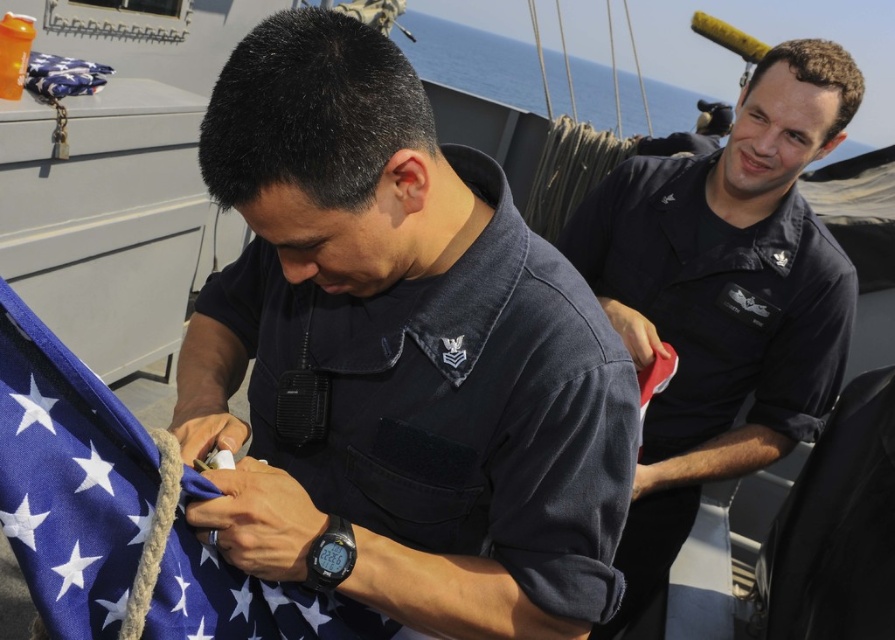
Can you confirm if dark blue uniform at center is taller than blue fabric flag at center?

Yes.

Which is more to the left, dark blue uniform at center or blue fabric flag at center?

From the viewer's perspective, blue fabric flag at center appears more on the left side.

Where is `dark blue uniform at center`? dark blue uniform at center is located at coordinates (397, 355).

Can you confirm if dark blue uniform at center is positioned above dark blue uniform at upper right?

Correct, dark blue uniform at center is located above dark blue uniform at upper right.

In order to click on dark blue uniform at center in this screenshot , I will do tap(397, 355).

Is dark blue uniform at upper right taller than blue fabric flag at center?

Yes, dark blue uniform at upper right is taller than blue fabric flag at center.

Between dark blue uniform at upper right and blue fabric flag at center, which one is positioned higher?

dark blue uniform at upper right is above.

From the picture: Who is more distant from viewer, (679, 401) or (141, 452)?

Positioned behind is point (679, 401).

You are a GUI agent. You are given a task and a screenshot of the screen. Output one action in this format:
    pyautogui.click(x=<x>, y=<y>)
    Task: Click on the dark blue uniform at upper right
    
    Given the screenshot: What is the action you would take?
    pyautogui.click(x=723, y=298)